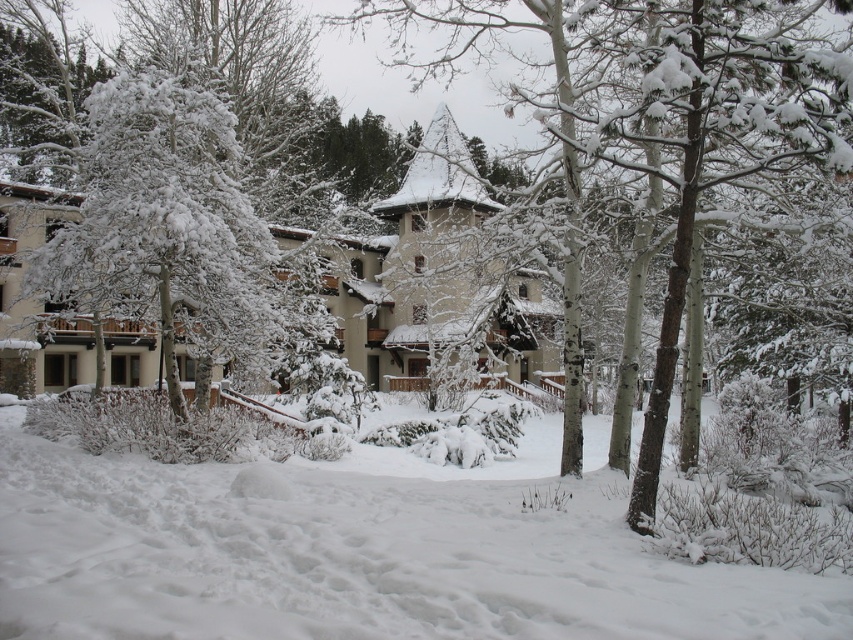
Based on the photo, you are standing at the origin point of the image. Which direction should you move to reach the white fluffy snow at center?

The white fluffy snow at center is located at coordinates point (358,554), so you should move towards the right and slightly upwards to reach it.